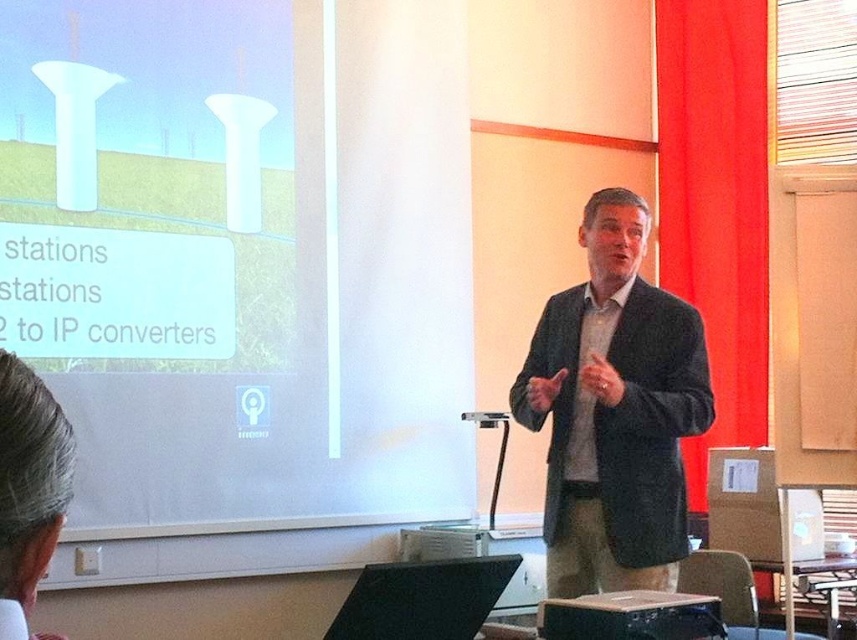
You are an attendee at the presentation. You see the dark gray suit at center and the gray hair at lower left. Which object is located to the right of the other?

The dark gray suit at center is positioned on the right side of gray hair at lower left.

You are an attendee at the presentation and want to take a photo of both the white matte projection screen at upper left and the dark gray suit at center. Which object should you focus on first to ensure both are in the frame?

The white matte projection screen at upper left is taller than the dark gray suit at center, so you should focus on the white matte projection screen at upper left first to ensure both are in the frame since it takes up more vertical space.

You are attending a presentation and want to focus on the slide. Which point, point (160, 380) or point (34, 509), is closer to the front of the slide?

Point (34, 509) is closer to the front of the slide because it is in front of point (160, 380).